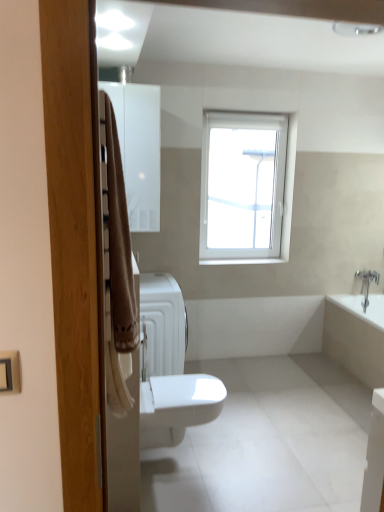
Question: In the image, is white glossy medicine cabinet at upper left on the left side or the right side of white plastic window at upper center?

Choices:
 (A) left
 (B) right

Answer: (A)

Question: Looking at their shapes, would you say white glossy medicine cabinet at upper left is wider or thinner than white plastic window at upper center?

Choices:
 (A) thin
 (B) wide

Answer: (B)

Question: Estimate the real-world distances between objects in this image. Which object is farther from the white glossy bidet at center?

Choices:
 (A) white glossy bathtub at lower right
 (B) beige fabric towel at left
 (C) white plastic window at upper center
 (D) white matte radiator at center
 (E) white glossy medicine cabinet at upper left

Answer: (C)

Question: Which of these objects is positioned farthest from the white glossy medicine cabinet at upper left?

Choices:
 (A) white plastic window at upper center
 (B) white glossy bathtub at lower right
 (C) white glossy bidet at center
 (D) beige fabric towel at left
 (E) white matte radiator at center

Answer: (B)